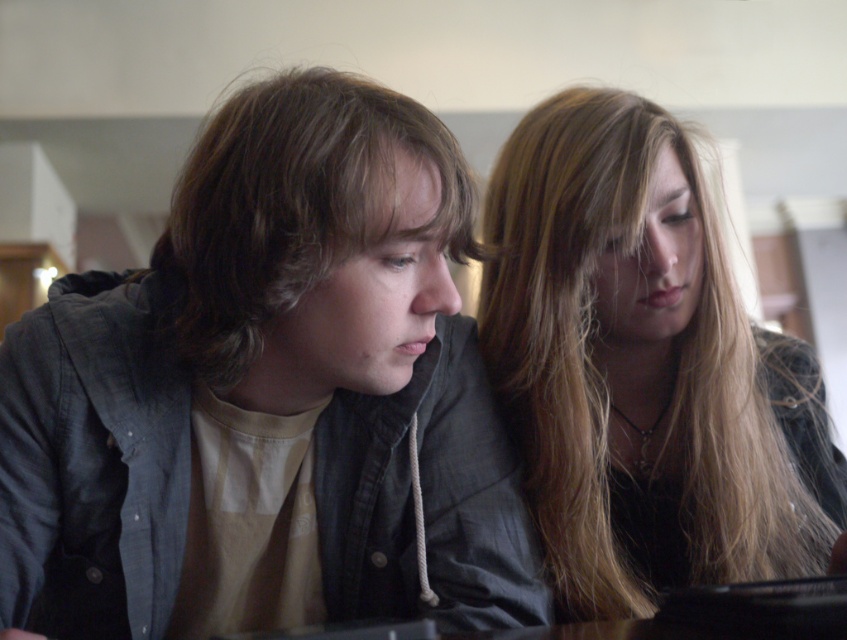
Question: Which of the following is the farthest from the observer?

Choices:
 (A) coord(584,444)
 (B) coord(258,280)

Answer: (A)

Question: Estimate the real-world distances between objects in this image. Which object is farther from the smooth black hair at center?

Choices:
 (A) matte gray jacket at center
 (B) brownhair at center

Answer: (B)

Question: Which point is farther to the camera?

Choices:
 (A) (372, 497)
 (B) (181, 260)

Answer: (A)

Question: Can you confirm if matte gray jacket at center is bigger than smooth black hair at center?

Choices:
 (A) yes
 (B) no

Answer: (A)

Question: Is matte gray jacket at center bigger than smooth black hair at center?

Choices:
 (A) yes
 (B) no

Answer: (A)

Question: Can you confirm if matte gray jacket at center is positioned below brownhair at center?

Choices:
 (A) yes
 (B) no

Answer: (A)